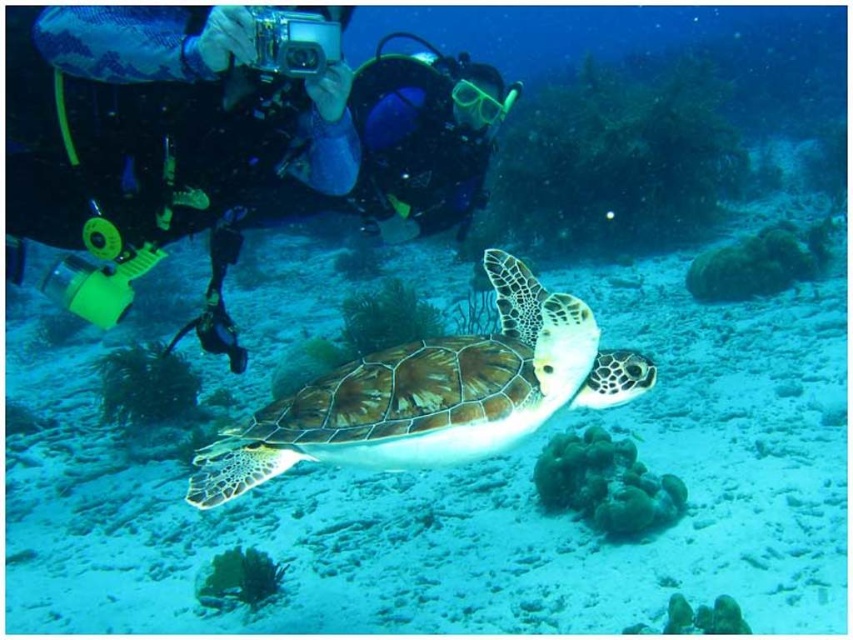
Is green textured shell at center taller than blue rubber diving mask at center?

No.

From the picture: Can you confirm if green textured shell at center is smaller than blue rubber diving mask at center?

Yes, green textured shell at center is smaller than blue rubber diving mask at center.

Who is more distant from viewer, (428, 461) or (387, 156)?

Positioned behind is point (387, 156).

Find the location of a particular element. The width and height of the screenshot is (853, 640). green textured shell at center is located at coordinates pos(434,394).